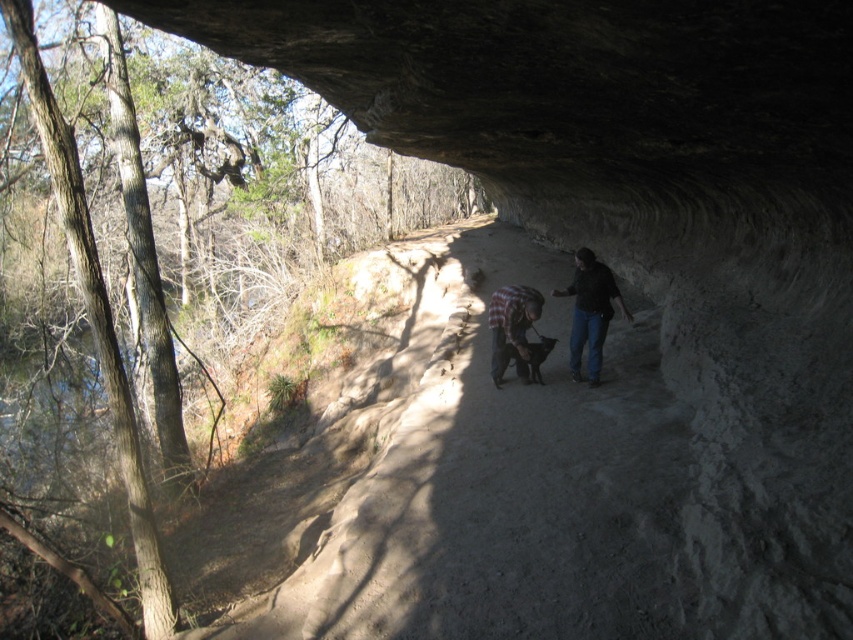
You are standing at the entrance of the tunnel and see the dark blue jeans at center. Based on their position, can you estimate whether they are closer to the entrance or the exit?

The dark blue jeans at center is located at point 0.487 in the x coordinate and 0.693 in the y coordinate, which places them near the center of the tunnel. This suggests they are equidistant from both the entrance and the exit.